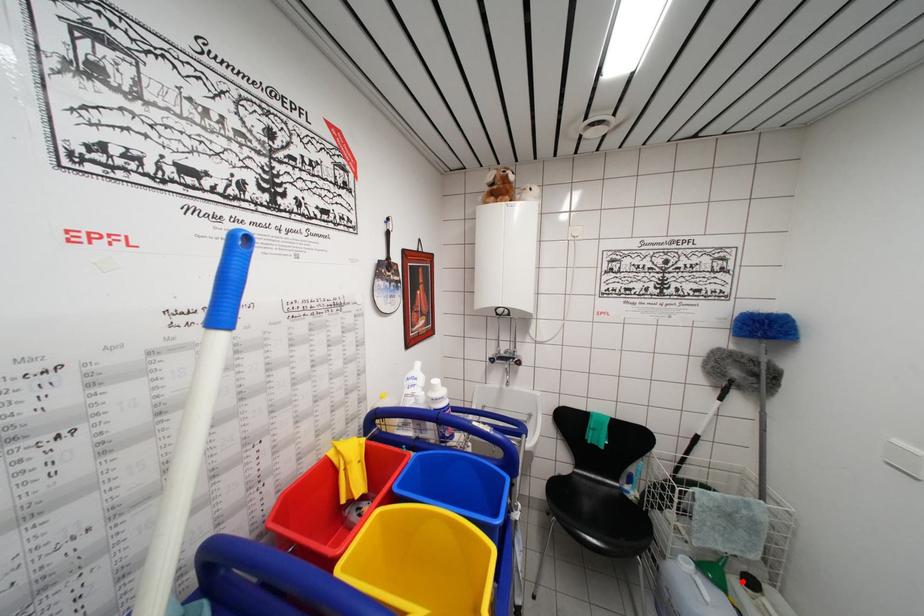
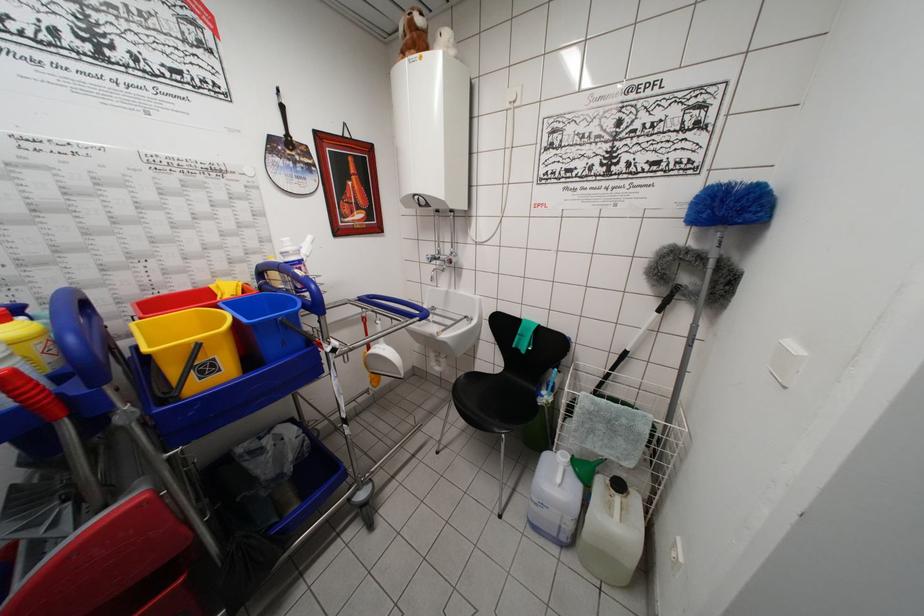
Find the pixel in the second image that matches the highlighted location in the first image.

(614, 483)